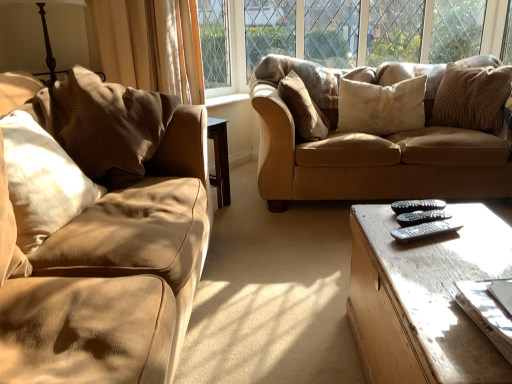
Locate an element on the screen. This screenshot has height=384, width=512. vacant area that lies to the right of black plastic remote at center, the 2th remote when ordered from front to back is located at coordinates (475, 219).